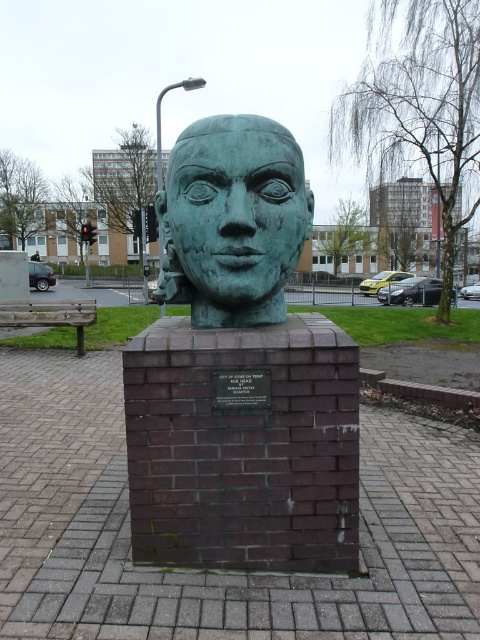
You are standing in front of the sculpture and want to touch the point at coordinates (240, 372). Which part of the sculpture will you be touching?

The point at coordinates (240, 372) is located on the green patina stone head at center, so touching that point would mean you are touching the head of the sculpture.

You are standing in front of the bronze bust on the brick pedestal. You notice two points marked on the pedestal. The first point is at coordinate point (343, 376) and the second is at point (277, 237). If you were to walk towards the first point, would you be moving towards the front or the back of the pedestal?

The point (343, 376) is in front of point (277, 237). Therefore, walking towards the first point would mean moving towards the front of the pedestal.

You are standing in front of the sculpture and want to know the exact position of the green patina stone head at center. Can you determine its coordinates based on the scene description?

The green patina stone head at center is located at point (240, 372).